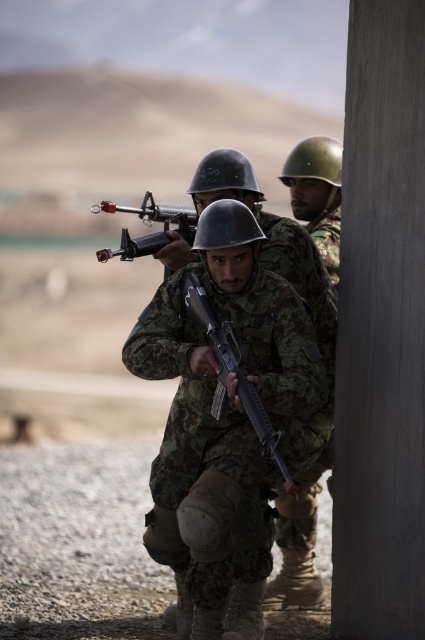
Who is more distant from viewer, (257, 349) or (181, 291)?

The point (181, 291) is more distant.

You are a GUI agent. You are given a task and a screenshot of the screen. Output one action in this format:
    pyautogui.click(x=<x>, y=<y>)
    Task: Click on the camouflage fabric rifle at center
    
    Given the screenshot: What is the action you would take?
    pyautogui.click(x=280, y=308)

This screenshot has height=640, width=425. In order to click on camouflage fabric rifle at center in this screenshot , I will do pos(280,308).